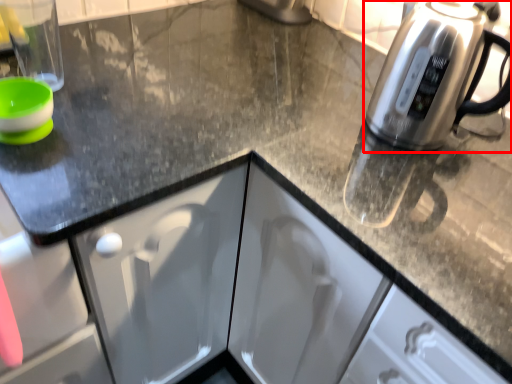
Question: From the image, what is the correct spatial relationship of kettle (annotated by the red box) in relation to appliance?

Choices:
 (A) right
 (B) left

Answer: (A)